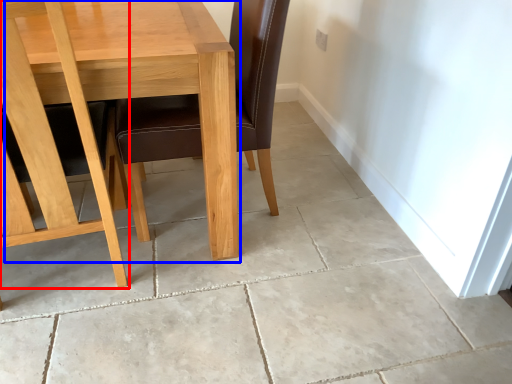
Question: Which of the following is the farthest to the observer, chair (highlighted by a red box) or table (highlighted by a blue box)?

Choices:
 (A) chair
 (B) table

Answer: (B)